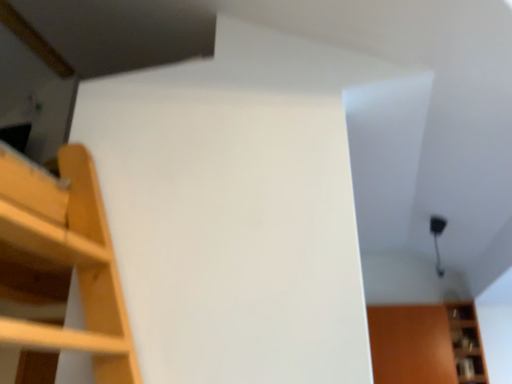
Question: Visually, is wooden at lower right positioned to the left or to the right of matte brown cabinet at lower right?

Choices:
 (A) left
 (B) right

Answer: (B)

Question: From the image's perspective, relative to matte brown cabinet at lower right, is wooden at lower right above or below?

Choices:
 (A) above
 (B) below

Answer: (A)

Question: Do you think wooden at lower right is within matte brown cabinet at lower right, or outside of it?

Choices:
 (A) inside
 (B) outside

Answer: (B)

Question: In the image, is matte brown cabinet at lower right on the left side or the right side of wooden at lower right?

Choices:
 (A) right
 (B) left

Answer: (B)

Question: Is matte brown cabinet at lower right spatially inside wooden at lower right, or outside of it?

Choices:
 (A) inside
 (B) outside

Answer: (B)

Question: From a real-world perspective, is matte brown cabinet at lower right positioned above or below wooden at lower right?

Choices:
 (A) above
 (B) below

Answer: (B)

Question: Considering the positions of matte brown cabinet at lower right and wooden at lower right in the image, is matte brown cabinet at lower right wider or thinner than wooden at lower right?

Choices:
 (A) wide
 (B) thin

Answer: (A)